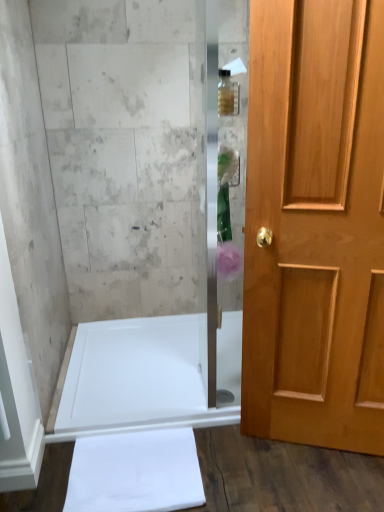
Where is `empty space that is ontop of white glossy bathtub at lower left (from a real-world perspective)`? empty space that is ontop of white glossy bathtub at lower left (from a real-world perspective) is located at coordinates (133, 359).